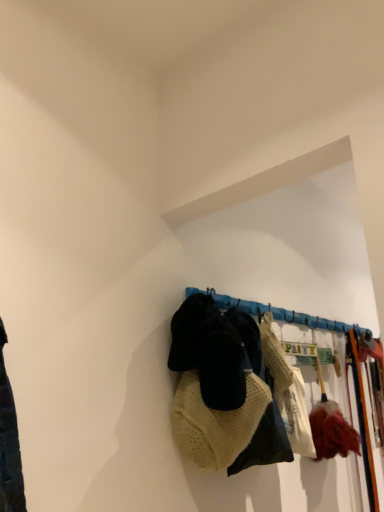
Where is `knitted sweater at center`? Image resolution: width=384 pixels, height=512 pixels. knitted sweater at center is located at coordinates (225, 389).

The height and width of the screenshot is (512, 384). Describe the element at coordinates (225, 389) in the screenshot. I see `knitted sweater at center` at that location.

This screenshot has width=384, height=512. I want to click on knitted sweater at center, so click(x=225, y=389).